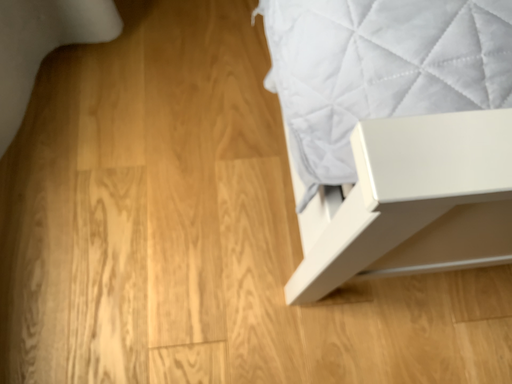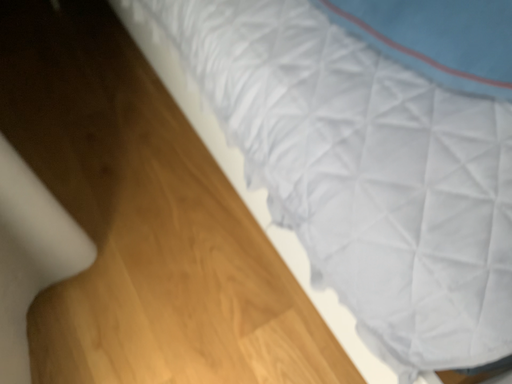
Question: Which way did the camera rotate in the video?

Choices:
 (A) rotated upward
 (B) rotated downward

Answer: (A)